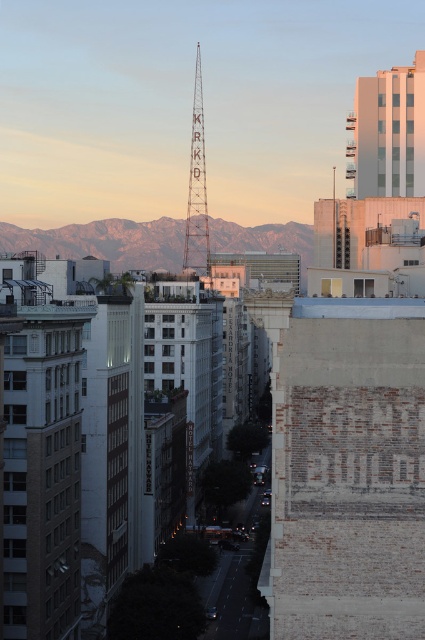
Question: Which point is closer to the camera taking this photo?

Choices:
 (A) (195, 218)
 (B) (370, 92)
 (C) (87, 232)

Answer: (B)

Question: Is gray rocky mountains at center thinner than metallic silver tower at center?

Choices:
 (A) yes
 (B) no

Answer: (B)

Question: Is gray rocky mountains at center positioned before white concrete building at upper right?

Choices:
 (A) yes
 (B) no

Answer: (B)

Question: Based on their relative distances, which object is farther from the white concrete building at upper right?

Choices:
 (A) gray rocky mountains at center
 (B) metallic silver tower at center

Answer: (A)

Question: Can you confirm if gray rocky mountains at center is positioned above metallic silver tower at center?

Choices:
 (A) no
 (B) yes

Answer: (A)

Question: Among these points, which one is nearest to the camera?

Choices:
 (A) (195, 140)
 (B) (138, 266)

Answer: (A)